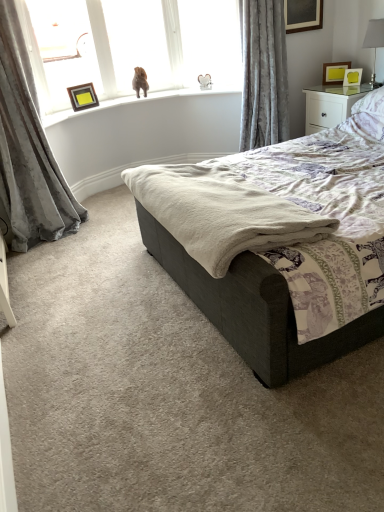
Question: Considering the positions of point (3, 23) and point (311, 192), is point (3, 23) closer or farther from the camera than point (311, 192)?

Choices:
 (A) closer
 (B) farther

Answer: (B)

Question: In the image, is velvet gray curtain at left, which is the 2th curtain from right to left, positioned in front of or behind dark gray fabric bed at center?

Choices:
 (A) front
 (B) behind

Answer: (B)

Question: Considering the real-world distances, which object is farthest from the velvet gray curtain at left, which is the 2th curtain from right to left?

Choices:
 (A) dark gray fabric bed at center
 (B) matte glass window screen at upper left
 (C) matte yellow picture frame at upper right, which ranks as the 2th picture frame in right-to-left order
 (D) white glossy table lamp at upper right
 (E) white soft pillow at upper right

Answer: (D)

Question: Which object is positioned farthest from the velvet gray curtain at left, which is the 2th curtain from right to left?

Choices:
 (A) gold metallic picture frame at upper right, which is counted as the first picture frame, starting from the right
 (B) wooden picture frame at upper left, the first picture frame viewed from the left
 (C) matte yellow picture frame at upper right, which is the second picture frame from left to right
 (D) dark gray fabric bed at center
 (E) white glossy nightstand at upper right

Answer: (A)